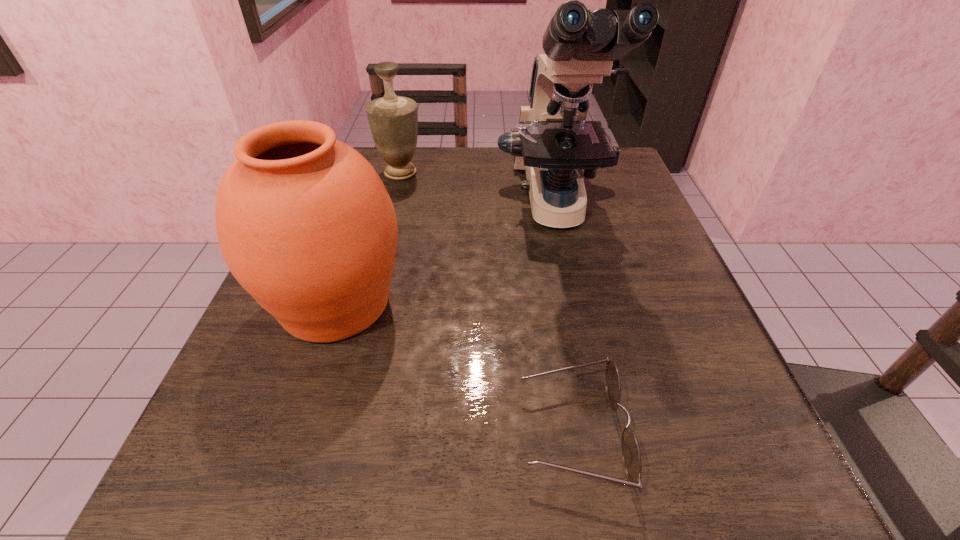
The height and width of the screenshot is (540, 960). I want to click on free space located on the front-facing side of the spectacles, so click(x=375, y=431).

Find the location of a particular element. The height and width of the screenshot is (540, 960). free space located 0.190m on the front-facing side of the spectacles is located at coordinates (375, 431).

Identify the location of vacant point located on the front-facing side of the spectacles. (453, 431).

This screenshot has height=540, width=960. I want to click on microscope that is at the far edge, so click(553, 141).

Image resolution: width=960 pixels, height=540 pixels. What are the coordinates of `urn that is at the far edge` in the screenshot? It's located at (393, 120).

At what (x,y) coordinates should I click in order to perform the action: click on object at the near edge. Please return your answer as a coordinate pair (x, y). Looking at the image, I should click on (631, 457).

Where is `object present at the right edge`? The width and height of the screenshot is (960, 540). object present at the right edge is located at coordinates (553, 141).

At what (x,y) coordinates should I click in order to perform the action: click on object that is at the far left corner. Please return your answer as a coordinate pair (x, y). Looking at the image, I should click on (393, 120).

Image resolution: width=960 pixels, height=540 pixels. I want to click on object located in the far right corner section of the desktop, so click(553, 141).

Where is `vacant region at the far edge of the desktop`? The width and height of the screenshot is (960, 540). vacant region at the far edge of the desktop is located at coordinates (439, 160).